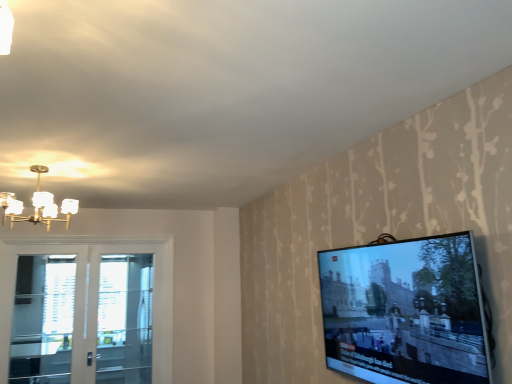
Question: Is matte glass chandelier at upper left a part of clear glass screen door at left, the 1th screen door from the left?

Choices:
 (A) no
 (B) yes

Answer: (A)

Question: From the image's perspective, is clear glass screen door at left, the 2th screen door in the right-to-left sequence, on matte glass chandelier at upper left?

Choices:
 (A) no
 (B) yes

Answer: (A)

Question: Is clear glass screen door at left, the 2th screen door in the right-to-left sequence, positioned behind matte glass chandelier at upper left?

Choices:
 (A) no
 (B) yes

Answer: (B)

Question: Is clear glass screen door at left, the 2th screen door in the right-to-left sequence, positioned beyond the bounds of matte glass chandelier at upper left?

Choices:
 (A) no
 (B) yes

Answer: (B)

Question: Is clear glass screen door at left, the 2th screen door in the right-to-left sequence, directly adjacent to matte glass chandelier at upper left?

Choices:
 (A) no
 (B) yes

Answer: (A)

Question: Is clear glass screen door at left, the 1th screen door from the left, in front of matte glass chandelier at upper left?

Choices:
 (A) yes
 (B) no

Answer: (B)

Question: Is flat screen tv at right wider than matte glass chandelier at upper left?

Choices:
 (A) no
 (B) yes

Answer: (A)

Question: Is flat screen tv at right behind matte glass chandelier at upper left?

Choices:
 (A) yes
 (B) no

Answer: (B)

Question: Does flat screen tv at right lie in front of matte glass chandelier at upper left?

Choices:
 (A) yes
 (B) no

Answer: (A)

Question: From a real-world perspective, does flat screen tv at right stand above matte glass chandelier at upper left?

Choices:
 (A) yes
 (B) no

Answer: (B)

Question: Can you confirm if flat screen tv at right is shorter than matte glass chandelier at upper left?

Choices:
 (A) yes
 (B) no

Answer: (B)

Question: Is matte glass chandelier at upper left at the back of flat screen tv at right?

Choices:
 (A) yes
 (B) no

Answer: (B)

Question: Is white glass door at left located within matte glass chandelier at upper left?

Choices:
 (A) no
 (B) yes

Answer: (A)